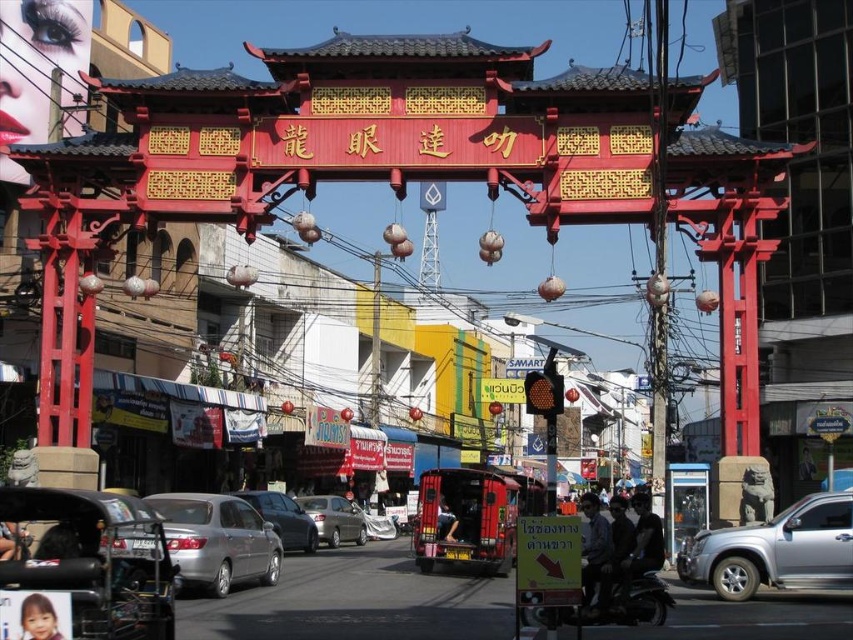
Question: Observing the image, what is the correct spatial positioning of silver metallic suv at center in reference to silver metallic car at center?

Choices:
 (A) left
 (B) right

Answer: (B)

Question: Which object is closer to the camera taking this photo?

Choices:
 (A) metallic silver motorcycle at center
 (B) satin silver car at center

Answer: (A)

Question: Is satin silver sedan at center thinner than silver metallic car at center?

Choices:
 (A) yes
 (B) no

Answer: (A)

Question: Which point is closer to the camera?

Choices:
 (A) (308, 513)
 (B) (641, 618)

Answer: (B)

Question: Which of the following is the closest to the observer?

Choices:
 (A) (306, 522)
 (B) (589, 612)
 (C) (331, 508)
 (D) (831, 502)

Answer: (B)

Question: Is silver metallic suv at center thinner than satin silver sedan at center?

Choices:
 (A) yes
 (B) no

Answer: (B)